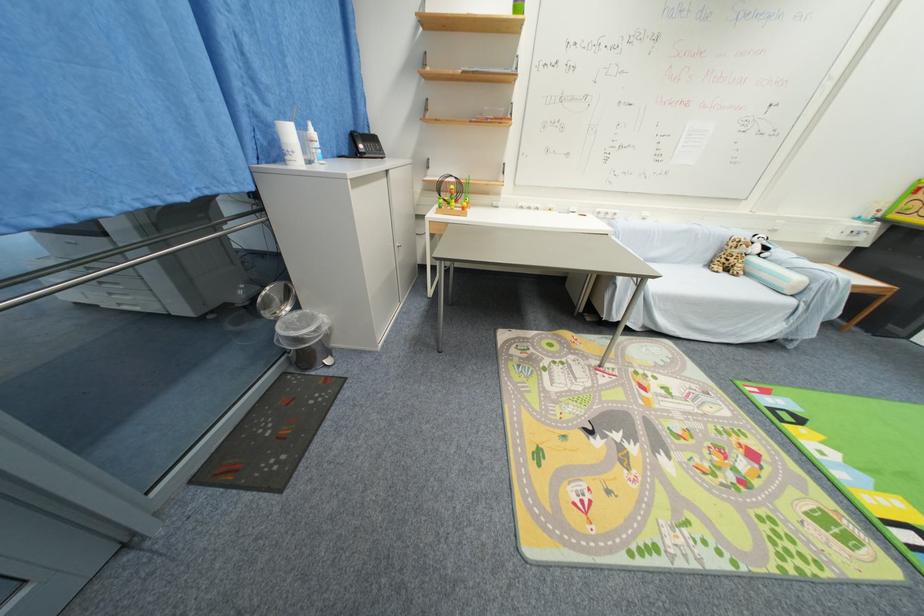
You are a GUI agent. You are given a task and a screenshot of the screen. Output one action in this format:
    pyautogui.click(x=<x>, y=<y>)
    Task: Click on the sofa armrest
    The image size is (924, 616).
    Given the screenshot: What is the action you would take?
    pyautogui.click(x=718, y=290)